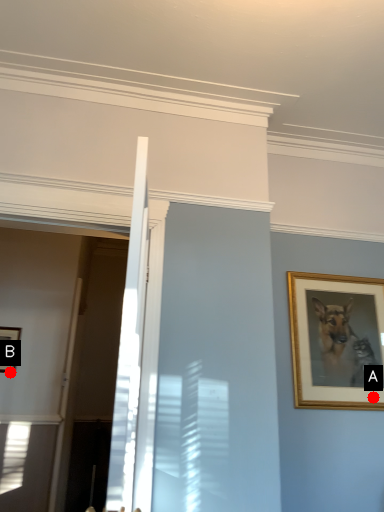
Question: Two points are circled on the image, labeled by A and B beside each circle. Which point is closer to the camera taking this photo?

Choices:
 (A) A is closer
 (B) B is closer

Answer: (A)